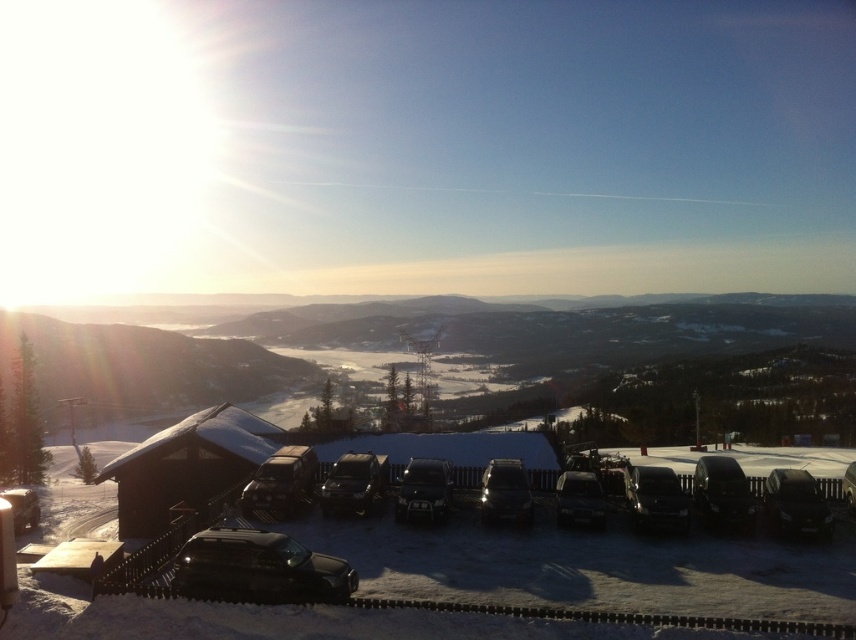
You are planning to park your car in the parking lot shown in the image. You see two vehicles already parked there, a black matte van at center and a black metallic car at center. Which vehicle takes up more space in the parking spot?

The black matte van at center is bigger than the black metallic car at center, so it takes up more space in the parking spot.

You are a delivery person who needs to load a large package onto the roof of one of the cars. Considering the black metallic car at center and the satin black suv at center, which vehicle would allow the package to be more securely placed without exceeding height restrictions?

The satin black suv at center has a greater height than the black metallic car at center, so the package would be more securely placed on the roof of the satin black suv at center without exceeding height restrictions.